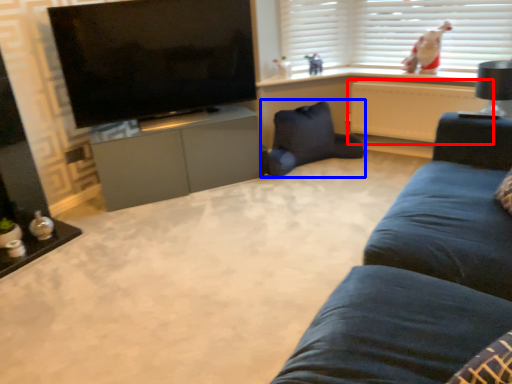
Question: Which point is closer to the camera, radiator (highlighted by a red box) or swivel chair (highlighted by a blue box)?

Choices:
 (A) radiator
 (B) swivel chair

Answer: (A)